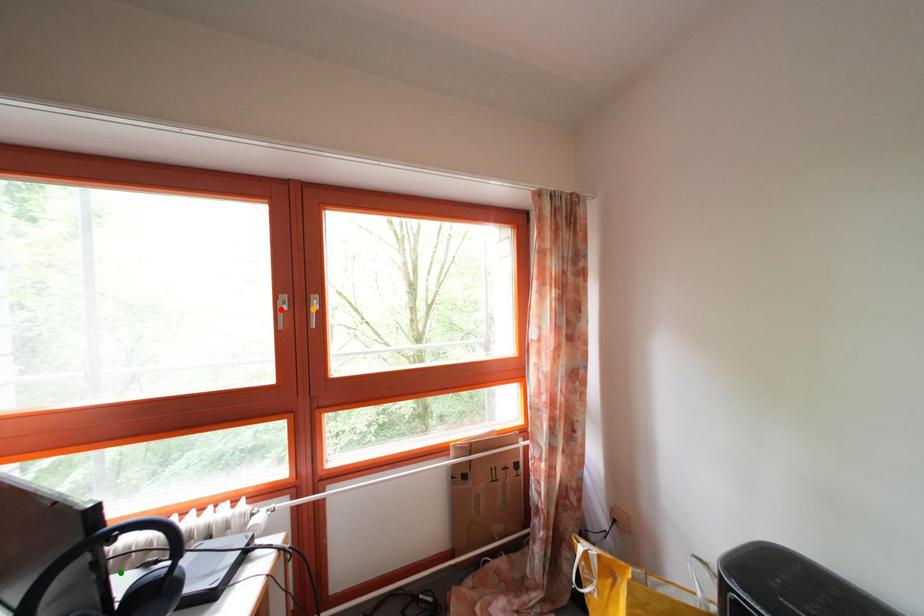
Order these from nearest to farthest:
A) red point
B) green point
C) orange point

green point < red point < orange point